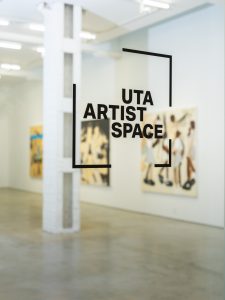
In order to click on vertical rectangular gray grooves on pillar in this screenshot , I will do `click(68, 31)`, `click(67, 88)`, `click(66, 151)`, `click(69, 223)`.